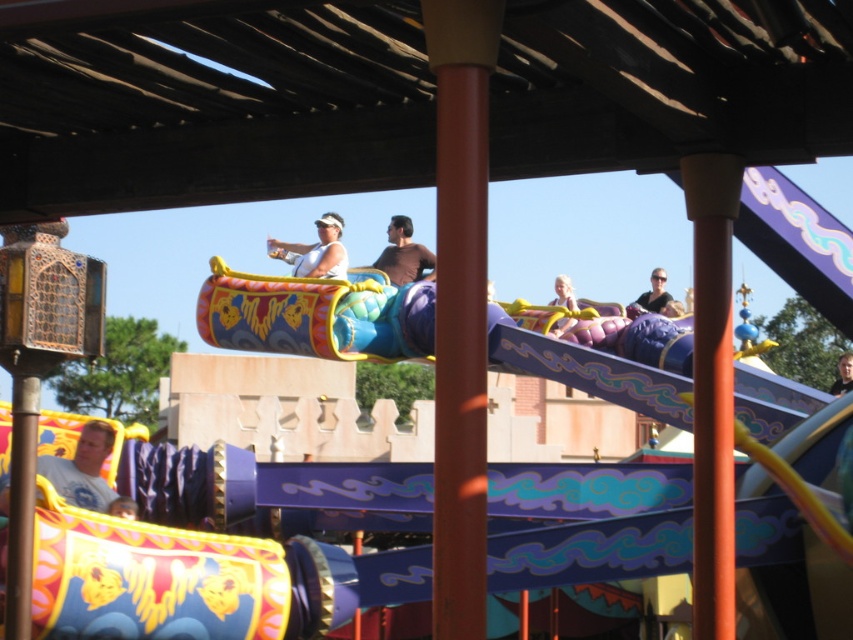
Question: Is white cotton shirt at lower left bigger than matte black sunglasses at upper center?

Choices:
 (A) yes
 (B) no

Answer: (A)

Question: Observing the image, what is the correct spatial positioning of matte black sunglasses at upper center in reference to smooth brown hair at upper center?

Choices:
 (A) left
 (B) right

Answer: (A)

Question: Which of the following is the closest to the observer?

Choices:
 (A) brown matte shirt at center
 (B) white matte tank top at center
 (C) matte black sunglasses at upper center

Answer: (C)

Question: Can you confirm if white matte tank top at center is bigger than brown matte shirt at center?

Choices:
 (A) yes
 (B) no

Answer: (A)

Question: Considering the real-world distances, which object is farthest from the white matte tank top at center?

Choices:
 (A) brown matte shirt at center
 (B) smooth brown hair at upper center

Answer: (B)

Question: Which object is closer to the camera taking this photo?

Choices:
 (A) matte black sunglasses at upper center
 (B) brown matte shirt at center
 (C) smooth brown hair at upper center

Answer: (A)